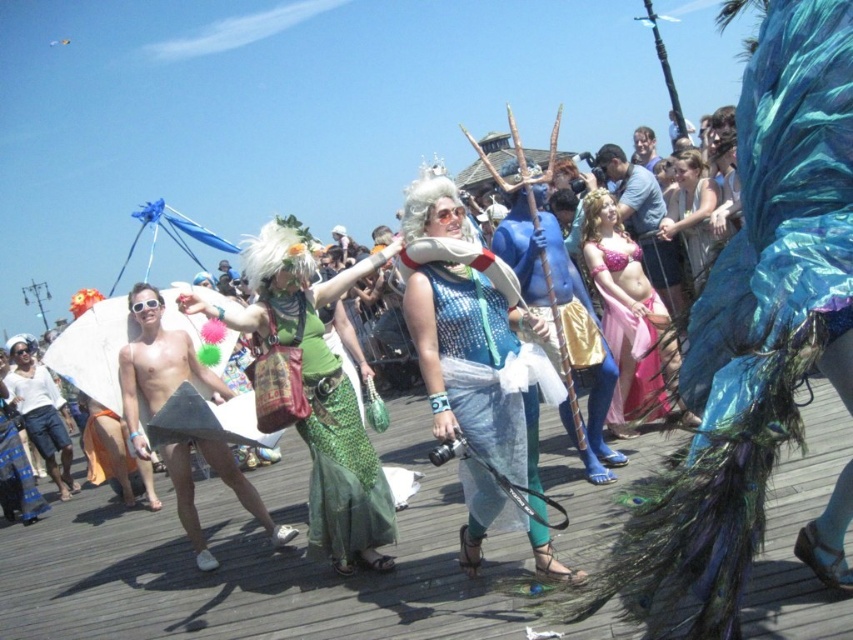
Question: Can you confirm if green sequined skirt at center is positioned above shiny blue fabric at center?

Choices:
 (A) no
 (B) yes

Answer: (A)

Question: Which point appears closest to the camera in this image?

Choices:
 (A) (694, 156)
 (B) (518, 288)
 (C) (680, 416)
 (D) (393, 250)

Answer: (C)

Question: Which of the following is the farthest from the observer?

Choices:
 (A) matte pink fabric dress at center
 (B) green sequined skirt at center
 (C) pink satin dress at center

Answer: (B)

Question: Estimate the real-world distances between objects in this image. Which object is farther from the matte pink fabric dress at center?

Choices:
 (A) pink satin dress at center
 (B) shiny blue fabric at center
 (C) green sequined dress at center
 (D) green sequined skirt at center

Answer: (D)

Question: Where is green sequined skirt at center located in relation to pink satin dress at center in the image?

Choices:
 (A) below
 (B) above

Answer: (A)

Question: Is green sequined skirt at center below pink satin dress at center?

Choices:
 (A) yes
 (B) no

Answer: (A)